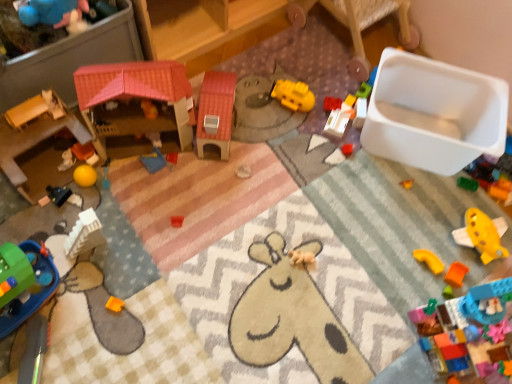
I want to click on free space between orange matte block at lower right, acting as the 14th toy starting from the left, and matte orange blocks at left, the eleventh toy viewed from the right, so click(x=263, y=219).